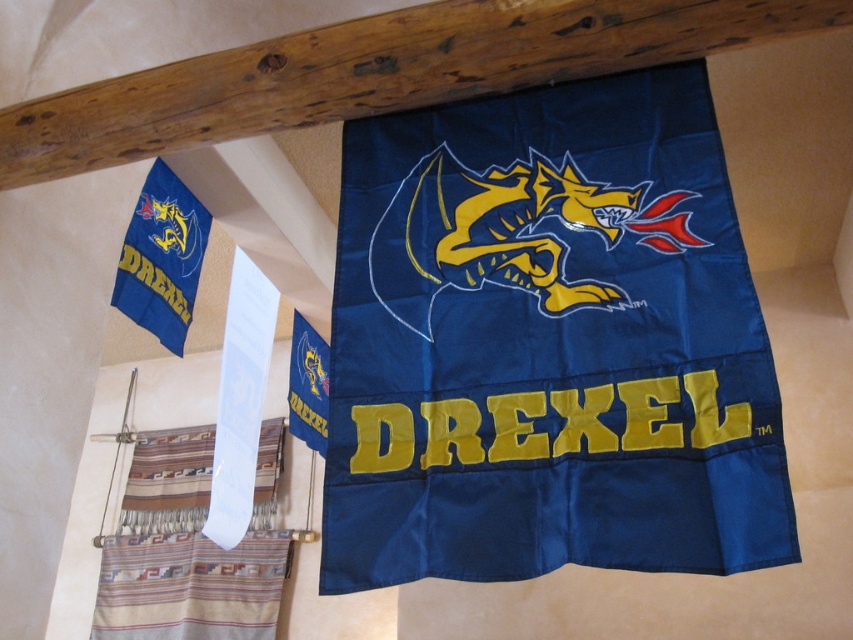
Question: Is navy blue fabric flag at center to the left of brown wooden beam at upper center from the viewer's perspective?

Choices:
 (A) no
 (B) yes

Answer: (A)

Question: Which object is positioned closest to the blue fabric flag at upper center?

Choices:
 (A) brown wooden beam at upper center
 (B) striped fabric curtain at lower left
 (C) matte blue flag at upper left

Answer: (B)

Question: Is striped fabric curtain at lower left closer to camera compared to blue fabric flag at upper center?

Choices:
 (A) yes
 (B) no

Answer: (B)

Question: Which point is farther to the camera?

Choices:
 (A) (213, 563)
 (B) (300, 403)

Answer: (A)

Question: Which object appears farthest from the camera in this image?

Choices:
 (A) striped fabric curtain at lower left
 (B) navy blue fabric flag at center

Answer: (A)

Question: Is brown wooden beam at upper center below striped fabric curtain at lower left?

Choices:
 (A) yes
 (B) no

Answer: (B)